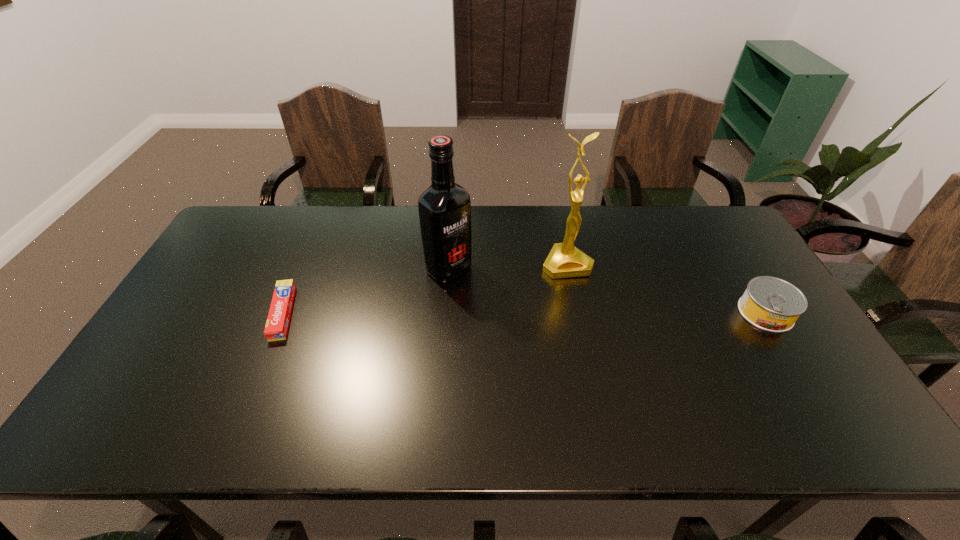
Find the location of `free spot located 0.080m on the front-facing side of the second object from left to right`. free spot located 0.080m on the front-facing side of the second object from left to right is located at coordinates (481, 295).

You are a GUI agent. You are given a task and a screenshot of the screen. Output one action in this format:
    pyautogui.click(x=<x>, y=<y>)
    Task: Click on the vacant space located 0.360m on the front-facing side of the third object from left to right
    The height and width of the screenshot is (540, 960).
    Given the screenshot: What is the action you would take?
    pyautogui.click(x=622, y=380)

In order to click on free spot located on the front-facing side of the third object from left to right in this screenshot , I will do `click(599, 330)`.

Identify the location of free spot located on the front-facing side of the third object from left to right. The height and width of the screenshot is (540, 960). (617, 370).

Where is `object located in the far edge section of the desktop`? object located in the far edge section of the desktop is located at coordinates (565, 260).

I want to click on object located in the right edge section of the desktop, so click(x=771, y=304).

Find the location of a particular element. Image resolution: width=960 pixels, height=540 pixels. vacant area at the far edge of the desktop is located at coordinates (662, 227).

This screenshot has width=960, height=540. I want to click on free region at the near edge, so [501, 402].

I want to click on vacant area at the right edge of the desktop, so click(736, 323).

Identify the location of vacant area at the near right corner. (805, 391).